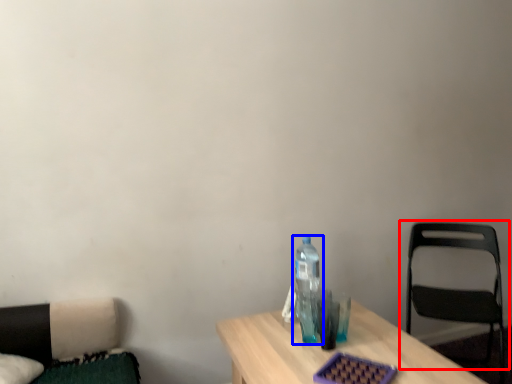
Question: Which object appears closest to the camera in this image, chair (highlighted by a red box) or bottle (highlighted by a blue box)?

Choices:
 (A) chair
 (B) bottle

Answer: (B)